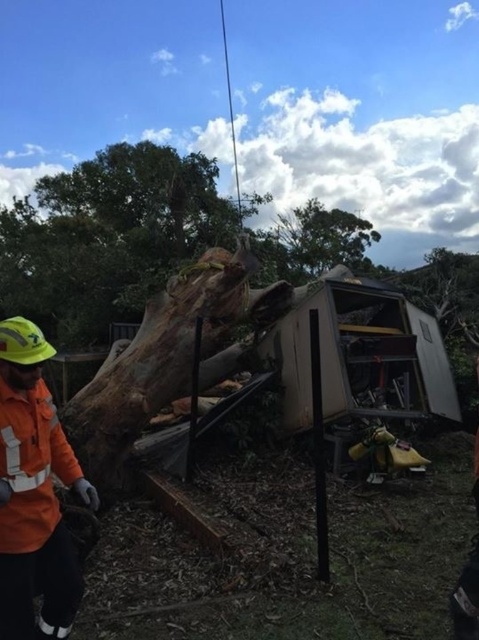
You are a delivery driver who just arrived at this location and see the orange reflective jacket at left and the orange fabric safety vest at lower left. Which item is positioned more to the left side of the scene?

The orange fabric safety vest at lower left is positioned more to the left side of the scene because the orange reflective jacket at left is to the right of it.

You are a safety inspector checking the scene of a fallen tree damaging a trailer. You notice an orange reflective jacket at left and an orange fabric safety vest at lower left. Based on their positions, which item is more likely to be closer to the damaged trailer?

The orange fabric safety vest at lower left is closer to the damaged trailer because it is positioned at lower left, which is typically nearer to the main structure in such scenes compared to the orange reflective jacket at left.

You are a safety inspector arriving at the accident site. You need to retrieve both the orange reflective jacket at left and the orange fabric safety vest at lower left. Considering the debris and tilted structure, can you safely reach both items without moving more than 2 inches from your current position?

The orange reflective jacket at left is 2.20 inches from the orange fabric safety vest at lower left. Since the distance between them is slightly more than 2 inches, you cannot safely retrieve both items without moving beyond the 2 inch limit.